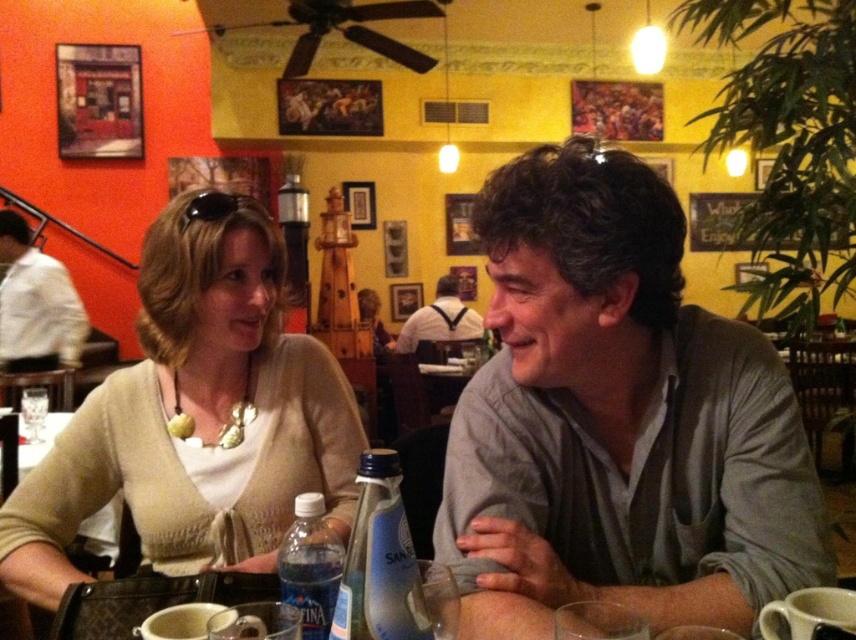
Does matte beige sweater at lower left come behind white shirt at center?

No, matte beige sweater at lower left is in front of white shirt at center.

Is matte beige sweater at lower left thinner than white shirt at center?

Incorrect, matte beige sweater at lower left's width is not less than white shirt at center's.

Does point (58, 426) come in front of point (440, 288)?

That is True.

Find the location of a particular element. This screenshot has width=856, height=640. matte beige sweater at lower left is located at coordinates click(99, 532).

Between white shirt at left and matte beige sweater at lower left, which one is positioned higher?

white shirt at left is above.

Can you confirm if white shirt at left is shorter than matte beige sweater at lower left?

Incorrect, white shirt at left's height does not fall short of matte beige sweater at lower left's.

Which is behind, point (61, 291) or point (99, 525)?

Point (61, 291)

The width and height of the screenshot is (856, 640). I want to click on white shirt at left, so click(34, 305).

Does gray matte shirt at center have a larger size compared to matte beige sweater at lower left?

No, gray matte shirt at center is not bigger than matte beige sweater at lower left.

Is gray matte shirt at center to the left of matte beige sweater at lower left from the viewer's perspective?

In fact, gray matte shirt at center is to the right of matte beige sweater at lower left.

Who is more forward, (x=550, y=444) or (x=21, y=420)?

Point (x=550, y=444) is more forward.

Locate an element on the screen. The height and width of the screenshot is (640, 856). gray matte shirt at center is located at coordinates (622, 412).